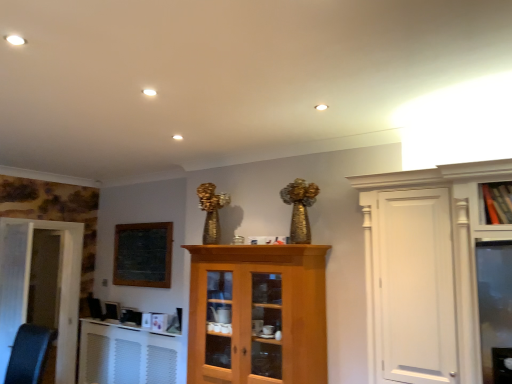
Question: Can you confirm if black leather swivel chair at lower left is wider than white matte door at left, marked as the second door in a back-to-front arrangement?

Choices:
 (A) yes
 (B) no

Answer: (A)

Question: Is black leather swivel chair at lower left to the right of white matte door at left, which is the first door from front to back, from the viewer's perspective?

Choices:
 (A) yes
 (B) no

Answer: (A)

Question: Can we say black leather swivel chair at lower left lies outside white matte door at left, marked as the second door in a back-to-front arrangement?

Choices:
 (A) no
 (B) yes

Answer: (B)

Question: Considering the relative positions of black leather swivel chair at lower left and white matte door at left, which is the first door from front to back, in the image provided, is black leather swivel chair at lower left in front of white matte door at left, which is the first door from front to back,?

Choices:
 (A) no
 (B) yes

Answer: (B)

Question: Is white matte door at left, which is the first door from front to back, at the back of black leather swivel chair at lower left?

Choices:
 (A) yes
 (B) no

Answer: (B)

Question: Considering the relative sizes of black leather swivel chair at lower left and white matte door at left, marked as the second door in a back-to-front arrangement, in the image provided, is black leather swivel chair at lower left thinner than white matte door at left, marked as the second door in a back-to-front arrangement,?

Choices:
 (A) no
 (B) yes

Answer: (A)

Question: Would you consider white textured radiator at lower left to be distant from wooden cabinet at center?

Choices:
 (A) no
 (B) yes

Answer: (B)

Question: Is white textured radiator at lower left in contact with wooden cabinet at center?

Choices:
 (A) yes
 (B) no

Answer: (B)

Question: Does white textured radiator at lower left have a greater width compared to wooden cabinet at center?

Choices:
 (A) yes
 (B) no

Answer: (B)

Question: From a real-world perspective, is white textured radiator at lower left located higher than wooden cabinet at center?

Choices:
 (A) no
 (B) yes

Answer: (A)

Question: Is wooden cabinet at center surrounded by white textured radiator at lower left?

Choices:
 (A) no
 (B) yes

Answer: (A)

Question: Is white textured radiator at lower left at the left side of wooden cabinet at center?

Choices:
 (A) yes
 (B) no

Answer: (A)

Question: From a real-world perspective, is wooden cabinet at upper right physically below white textured radiator at lower left?

Choices:
 (A) yes
 (B) no

Answer: (B)